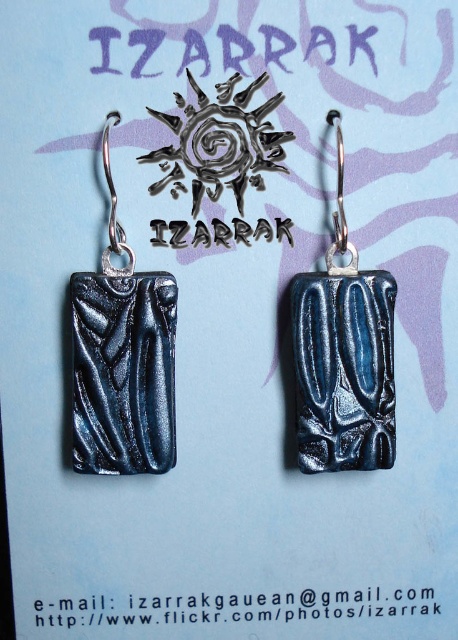
Is metallic blue stone at center below metallic blue rectangle at center?

Correct, metallic blue stone at center is located below metallic blue rectangle at center.

Is metallic blue stone at center positioned before metallic blue rectangle at center?

Yes, it is.

At what (x,y) coordinates should I click in order to perform the action: click on metallic blue stone at center. Please return your answer as a coordinate pair (x, y). Looking at the image, I should click on (123, 358).